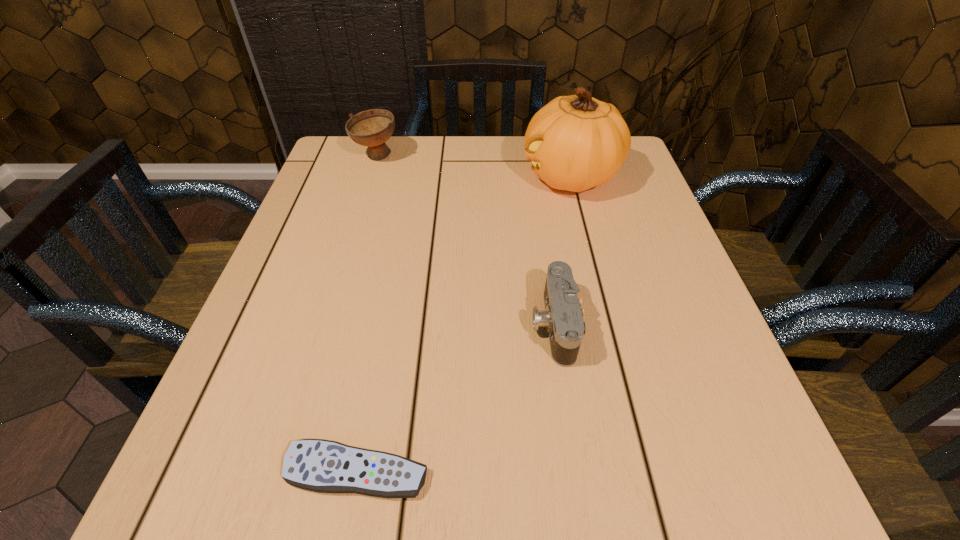
Where is `vacant region located 0.340m on the lens of the camera`? The image size is (960, 540). vacant region located 0.340m on the lens of the camera is located at coordinates pyautogui.click(x=338, y=325).

The height and width of the screenshot is (540, 960). I want to click on free region located 0.140m on the lens of the camera, so click(x=452, y=325).

Identify the location of free region located on the lens of the camera. Image resolution: width=960 pixels, height=540 pixels. (486, 325).

What are the coordinates of `vacant space positioned on the left of the shortest object` in the screenshot? It's located at (189, 471).

Locate an element on the screen. The image size is (960, 540). pumpkin that is at the far edge is located at coordinates [x=576, y=142].

At what (x,y) coordinates should I click in order to perform the action: click on soup bowl that is at the far edge. Please return your answer as a coordinate pair (x, y). The width and height of the screenshot is (960, 540). Looking at the image, I should click on (372, 128).

This screenshot has height=540, width=960. In order to click on object present at the near edge in this screenshot , I will do `click(318, 465)`.

You are a GUI agent. You are given a task and a screenshot of the screen. Output one action in this format:
    pyautogui.click(x=<x>, y=<y>)
    Task: Click on the soup bowl located in the left edge section of the desktop
    Image resolution: width=960 pixels, height=540 pixels.
    Given the screenshot: What is the action you would take?
    pyautogui.click(x=372, y=128)

Identify the location of remote control present at the left edge. Image resolution: width=960 pixels, height=540 pixels. (318, 465).

What are the coordinates of `object present at the right edge` in the screenshot? It's located at (576, 142).